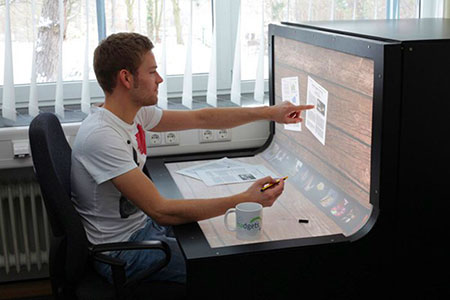
I want to click on mug, so click(257, 231).